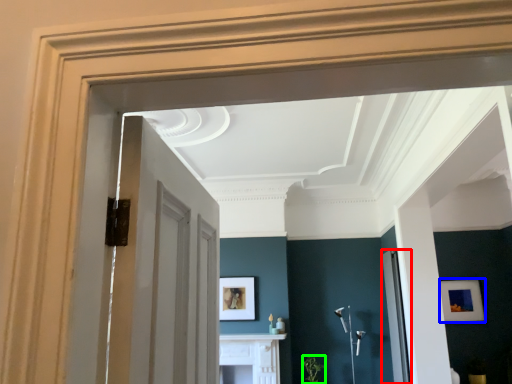
Question: Which object is the closest to the glass door (highlighted by a red box)? Choose among these: picture frame (highlighted by a blue box) or plant (highlighted by a green box).

Choices:
 (A) picture frame
 (B) plant

Answer: (B)